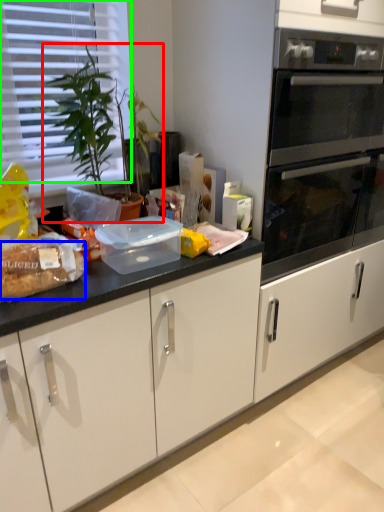
Question: Based on their relative distances, which object is nearer to houseplant (highlighted by a red box)? Choose from food (highlighted by a blue box) and blind (highlighted by a green box).

Choices:
 (A) food
 (B) blind

Answer: (B)